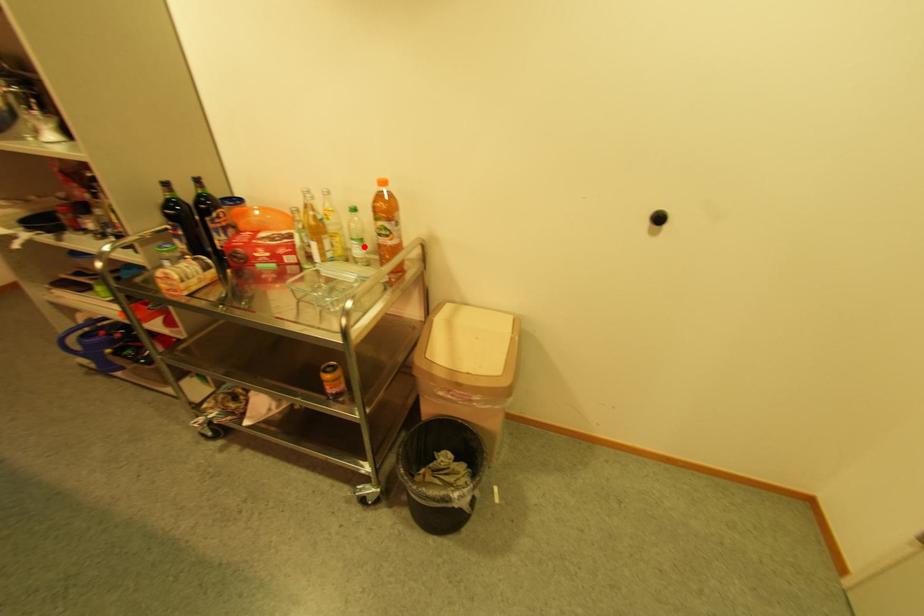
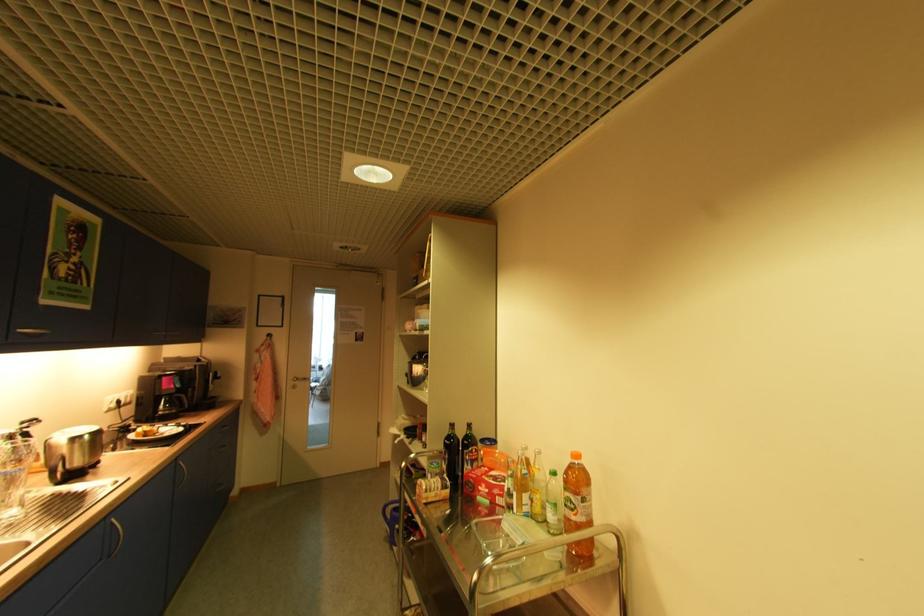
Locate, in the second image, the point that corresponds to the highlighted location in the first image.

(555, 511)